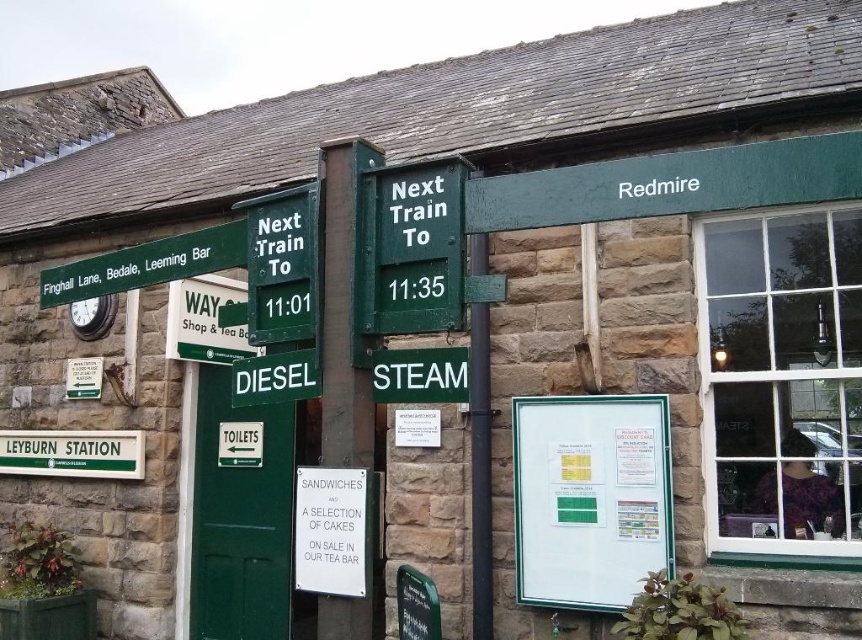
Question: Considering the relative positions of green metal signboard at upper left and matte green sign at center in the image provided, where is green metal signboard at upper left located with respect to matte green sign at center?

Choices:
 (A) left
 (B) right

Answer: (A)

Question: Which point is farther from the camera taking this photo?

Choices:
 (A) (519, 534)
 (B) (342, 544)

Answer: (A)

Question: Among these objects, which one is nearest to the camera?

Choices:
 (A) whiteboard at center
 (B) green metal signboard at upper left

Answer: (B)

Question: Among these objects, which one is nearest to the camera?

Choices:
 (A) green metal signpost at center
 (B) green metal signboard at upper left

Answer: (A)

Question: Does whiteboard at center appear on the right side of white paper sign at center?

Choices:
 (A) yes
 (B) no

Answer: (A)

Question: Does green matte sign at center have a smaller size compared to green metal signpost at center?

Choices:
 (A) no
 (B) yes

Answer: (B)